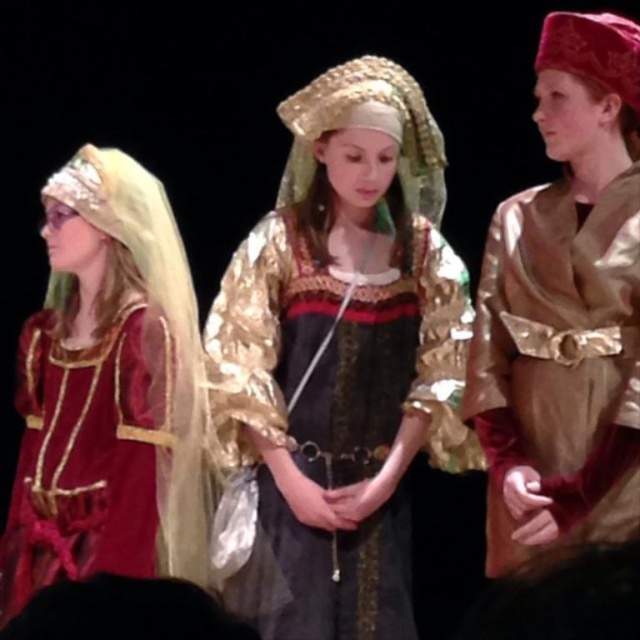
You are a costume designer assessing the stage layout. The gold satin robe at right and the matte gold dress at center are part of the same performance. Which costume takes up more horizontal space on the stage?

The matte gold dress at center takes up more horizontal space on the stage since it has a greater width than the gold satin robe at right.

You are directing a play and need to position two important props at points marked as point (522, 193) and point (99, 397). Which prop should be placed closer to the audience for better visibility?

The prop placed at point (522, 193) should be closer to the audience because it is closer to the camera than point (99, 397).

You are a costume designer assessing the stage setup. The gold metallic dress at center and the gold satin robe at right are part of the ensemble. Which costume is bigger in size?

The gold metallic dress at center is larger in size compared to the gold satin robe at right according to the description.